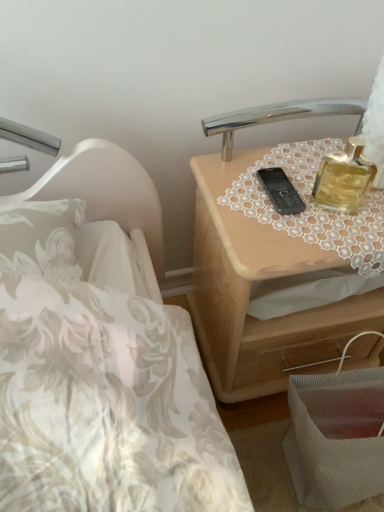
Question: From the image's perspective, is lace fabric at upper right under gold glass perfume at upper right?

Choices:
 (A) no
 (B) yes

Answer: (B)

Question: From a real-world perspective, is lace fabric at upper right physically above gold glass perfume at upper right?

Choices:
 (A) no
 (B) yes

Answer: (A)

Question: Could you tell me if lace fabric at upper right is turned towards gold glass perfume at upper right?

Choices:
 (A) yes
 (B) no

Answer: (B)

Question: Would you say lace fabric at upper right is outside gold glass perfume at upper right?

Choices:
 (A) no
 (B) yes

Answer: (B)

Question: Considering the relative sizes of lace fabric at upper right and gold glass perfume at upper right in the image provided, is lace fabric at upper right thinner than gold glass perfume at upper right?

Choices:
 (A) yes
 (B) no

Answer: (B)

Question: Is there a large distance between lace fabric at upper right and gold glass perfume at upper right?

Choices:
 (A) yes
 (B) no

Answer: (B)

Question: Is the surface of gold glass perfume at upper right in direct contact with light wood nightstand at upper right?

Choices:
 (A) yes
 (B) no

Answer: (B)

Question: Can you confirm if gold glass perfume at upper right is thinner than light wood nightstand at upper right?

Choices:
 (A) no
 (B) yes

Answer: (B)

Question: Is light wood nightstand at upper right at the back of gold glass perfume at upper right?

Choices:
 (A) yes
 (B) no

Answer: (B)

Question: Can you confirm if gold glass perfume at upper right is bigger than light wood nightstand at upper right?

Choices:
 (A) no
 (B) yes

Answer: (A)

Question: Can you confirm if gold glass perfume at upper right is taller than light wood nightstand at upper right?

Choices:
 (A) no
 (B) yes

Answer: (A)

Question: Is gold glass perfume at upper right further to the viewer compared to light wood nightstand at upper right?

Choices:
 (A) yes
 (B) no

Answer: (B)

Question: Would you say lace fabric at upper right is part of gold glass perfume at upper right's contents?

Choices:
 (A) no
 (B) yes

Answer: (A)